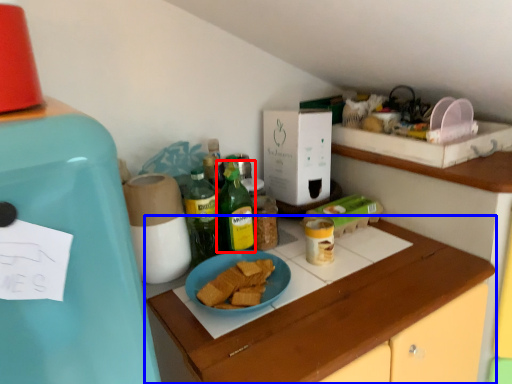
Question: Which object appears closest to the camera in this image, bottle (highlighted by a red box) or cabinetry (highlighted by a blue box)?

Choices:
 (A) bottle
 (B) cabinetry

Answer: (B)